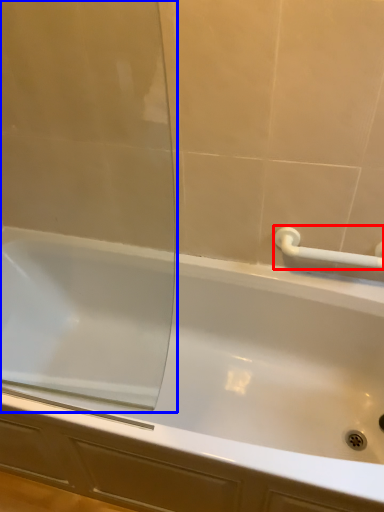
Question: Which point is further to the camera, towel bar (highlighted by a red box) or screen door (highlighted by a blue box)?

Choices:
 (A) towel bar
 (B) screen door

Answer: (A)